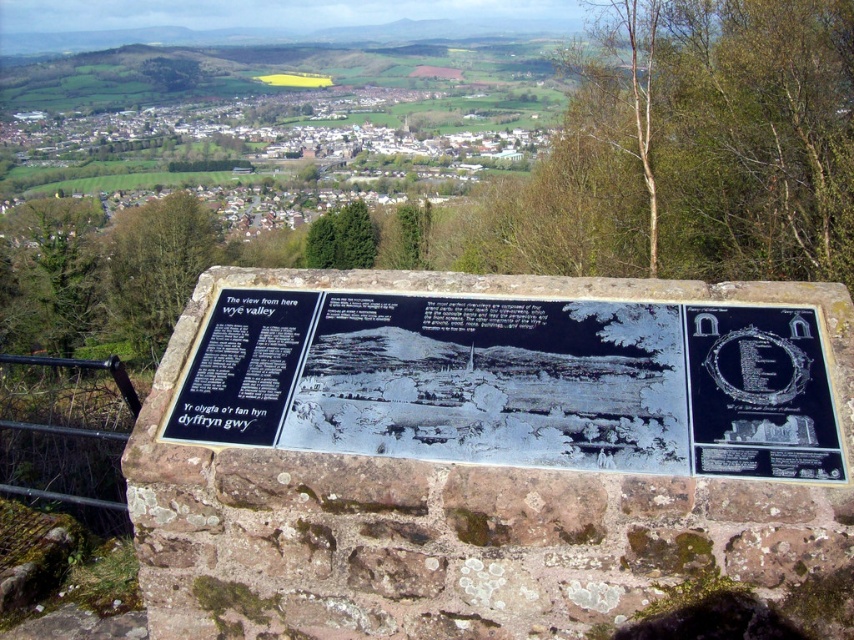
You are a tourist standing at the overlook point and want to read both the black stone sign at center and the black stone plaque at upper right. Which object is wider so you can read it more easily from where you are standing?

The black stone sign at center is wider than the black stone plaque at upper right, so it is easier to read from your current position.

Consider the image. You are a tourist standing at the overlook point and want to read both the black stone sign at center and the black stone plaque at upper right. Which object should you look at first to read them in the order from left to right?

You should look at the black stone sign at center first because it is positioned to the left of the black stone plaque at upper right, so from left to right, the order is black stone sign at center followed by black stone plaque at upper right.

You are standing at the overlook point and want to read the bilingual text on the black stone sign at center. Where should you position yourself to ensure you can see both the English text on the left and the Welsh text on the right clearly?

The black stone sign at center is located at point [516,381], so you should position yourself directly in front of it to see both the English text on the left and the Welsh text on the right clearly.